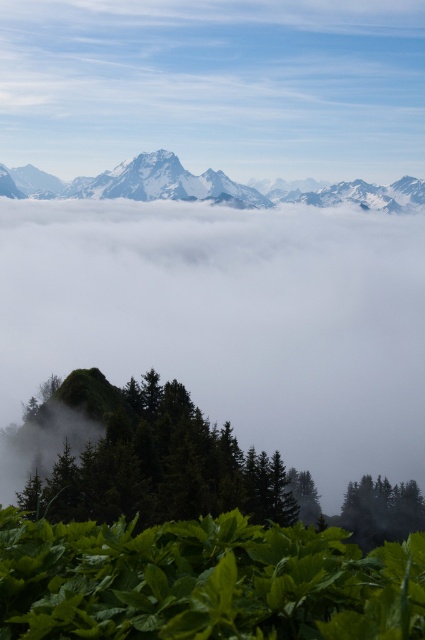
Can you confirm if white fluffy cloud at center is thinner than green leafy plant at lower center?

Incorrect, white fluffy cloud at center's width is not less than green leafy plant at lower center's.

Who is taller, white fluffy cloud at center or green leafy plant at lower center?

With more height is white fluffy cloud at center.

This screenshot has width=425, height=640. I want to click on white fluffy cloud at center, so click(231, 320).

Is point (340, 532) farther from camera compared to point (51, 499)?

No, (340, 532) is in front of (51, 499).

Is green leafy plant at lower center to the left of green matte tree at center from the viewer's perspective?

In fact, green leafy plant at lower center is to the right of green matte tree at center.

Is point (62, 528) more distant than point (178, 467)?

No, it is in front of (178, 467).

Locate an element on the screen. This screenshot has height=640, width=425. green leafy plant at lower center is located at coordinates (204, 580).

Can you confirm if green matte tree at center is shorter than snowy granite mountain range at upper center?

Indeed, green matte tree at center has a lesser height compared to snowy granite mountain range at upper center.

Which of these two, green matte tree at center or snowy granite mountain range at upper center, stands shorter?

green matte tree at center

In order to click on green matte tree at center in this screenshot , I will do `click(152, 460)`.